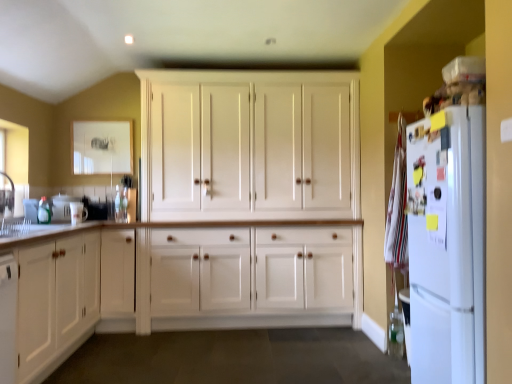
Question: Is white wood cabinet at center, arranged as the 1th cabinetry when viewed from the back, spatially inside white glossy sink at left, or outside of it?

Choices:
 (A) outside
 (B) inside

Answer: (A)

Question: Considering the positions of point (343, 91) and point (57, 201), is point (343, 91) closer or farther from the camera than point (57, 201)?

Choices:
 (A) farther
 (B) closer

Answer: (A)

Question: Based on their relative distances, which object is nearer to the white glossy sink at left?

Choices:
 (A) white wood cabinet at left, which appears as the second cabinetry when viewed from the back
 (B) white glossy mug at left
 (C) white matte refrigerator at right
 (D) white wood cabinet at center, marked as the 2th cabinetry in a front-to-back arrangement

Answer: (B)

Question: Which object is positioned farthest from the white wood cabinet at center, marked as the 2th cabinetry in a front-to-back arrangement?

Choices:
 (A) white matte refrigerator at right
 (B) white glossy mug at left
 (C) white wood cabinet at left, which appears as the 1th cabinetry when viewed from the front
 (D) white glossy sink at left

Answer: (A)